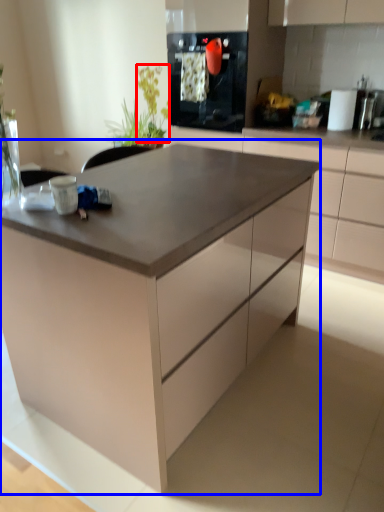
Question: Among these objects, which one is farthest to the camera, plant (highlighted by a red box) or table (highlighted by a blue box)?

Choices:
 (A) plant
 (B) table

Answer: (A)